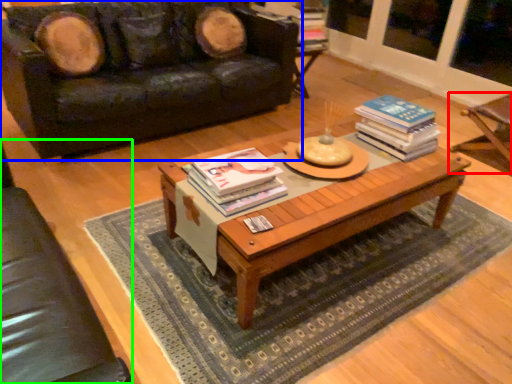
Question: Which object is the closest to the armchair (highlighted by a red box)? Choose among these: studio couch (highlighted by a blue box) or armchair (highlighted by a green box).

Choices:
 (A) studio couch
 (B) armchair

Answer: (A)